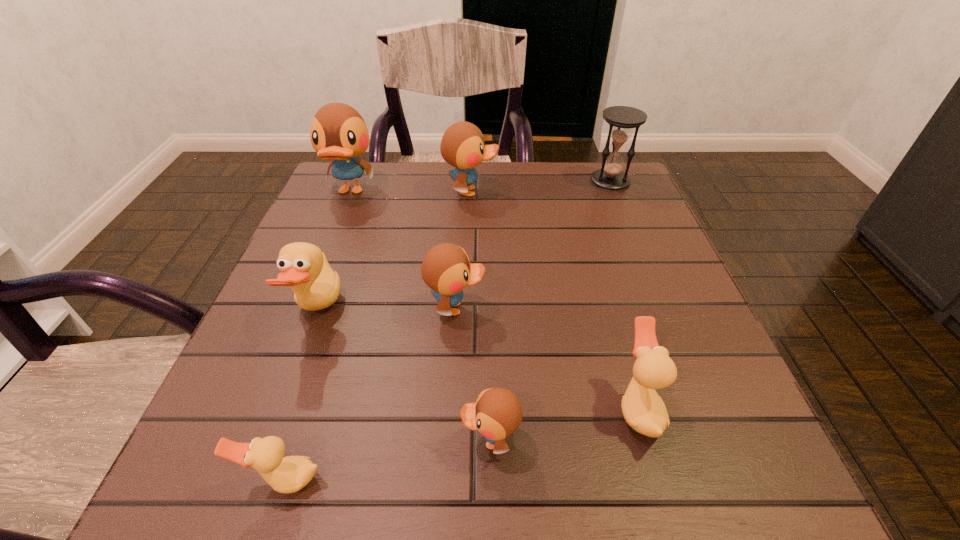
You are a GUI agent. You are given a task and a screenshot of the screen. Output one action in this format:
    pyautogui.click(x=<x>, y=<y>)
    Task: Click on the free space at the near edge
    
    Given the screenshot: What is the action you would take?
    pyautogui.click(x=513, y=495)

The width and height of the screenshot is (960, 540). I want to click on vacant point at the left edge, so click(324, 319).

Identify the location of vacant space at the right edge of the desktop. This screenshot has width=960, height=540. (662, 329).

Image resolution: width=960 pixels, height=540 pixels. In order to click on vacant space at the far right corner in this screenshot , I will do `click(609, 194)`.

Image resolution: width=960 pixels, height=540 pixels. I want to click on blank region between the farthest tan duck and the nearest tan duck, so [301, 395].

Where is `vacant point located between the smallest blue duck and the smallest tan duck`? vacant point located between the smallest blue duck and the smallest tan duck is located at coordinates (387, 460).

I want to click on free space between the second farthest tan duck and the second biggest blue duck, so click(554, 300).

The image size is (960, 540). What are the coordinates of `free spot between the nearest tan duck and the farthest tan duck` in the screenshot? It's located at (301, 395).

Image resolution: width=960 pixels, height=540 pixels. Find the location of `unoccupied area between the nearest blue duck and the nearest tan duck`. unoccupied area between the nearest blue duck and the nearest tan duck is located at coordinates pos(387,460).

This screenshot has width=960, height=540. I want to click on vacant point located between the nearest tan duck and the smallest blue duck, so click(x=387, y=460).